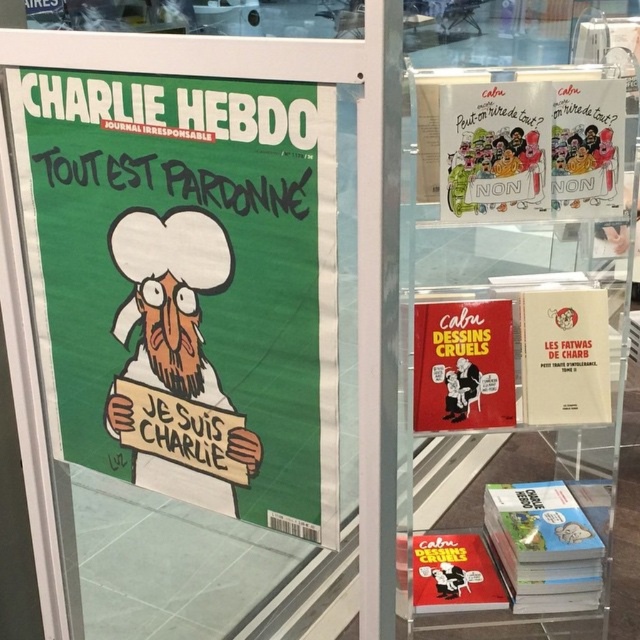
You are an art curator examining the display case. You need to place a protective cover over the red matte book at center and the matte red book at lower center. Which book should you cover first if you want to start with the one closer to you?

You should cover the red matte book at center first because it is closer to the viewer than the matte red book at lower center.

You are organizing a library shelf and have two books to place. The red matte book at center and the matte red book at lower center. Which one is taller?

The red matte book at center is taller than the matte red book at lower center.